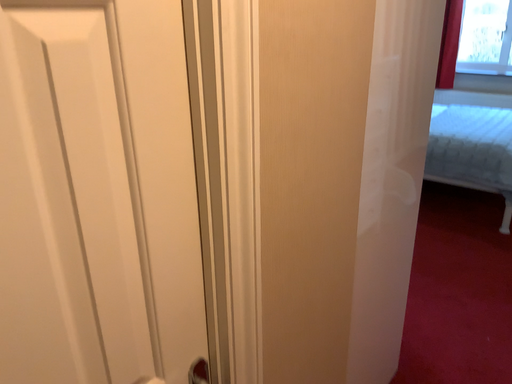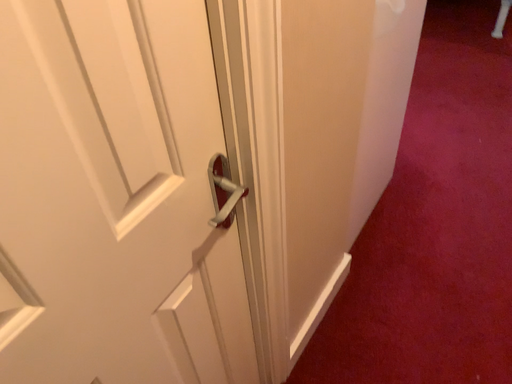
Question: How did the camera likely rotate when shooting the video?

Choices:
 (A) rotated downward
 (B) rotated upward

Answer: (A)